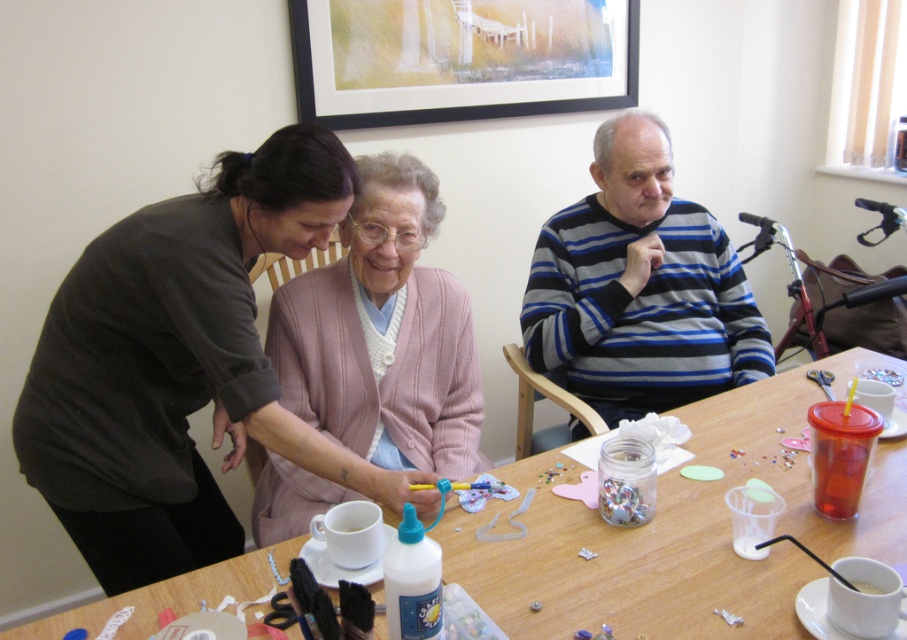
You are standing in the room and want to place a small vase on the wooden table at center. However, there is a matte black sweater at upper left in the way. Can you move the vase from the sweater to the table without moving the sweater?

The wooden table at center is behind the matte black sweater at upper left, so you can move the vase from the matte black sweater at upper left to the wooden table at center by moving it around the sweater since the table is positioned behind it.

You are organizing a craft event and need to place a decorative item on the wooden table at center. However, there is a matte black sweater at upper left nearby. Based on their positions, can you determine if the sweater is to the left or right side of the table?

The matte black sweater at upper left is to the left of the wooden table at center.